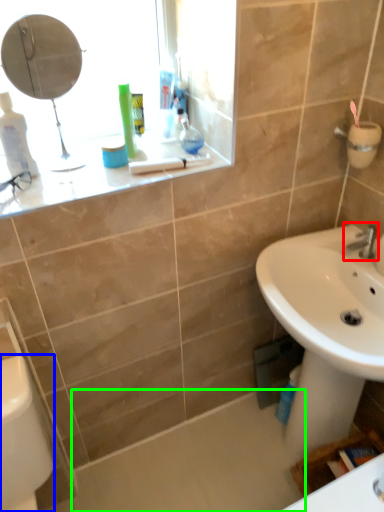
Question: Which is farther away from tap (highlighted by a red box)? porcelain (highlighted by a blue box) or bath (highlighted by a green box)?

Choices:
 (A) porcelain
 (B) bath

Answer: (A)